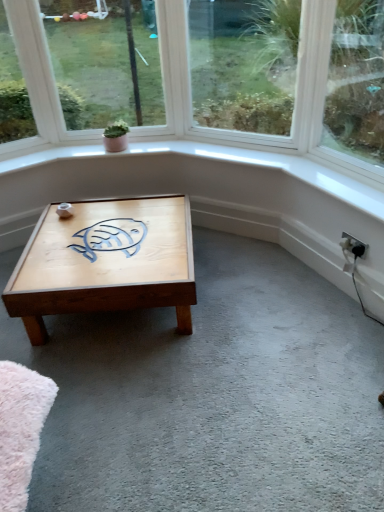
Identify the location of vacant space to the right of green matte plant at upper center. (141, 148).